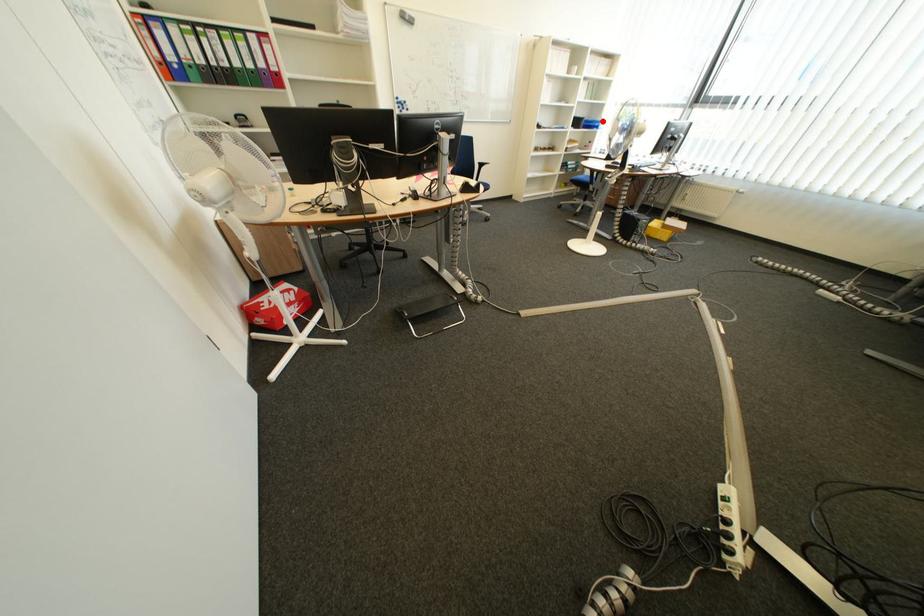
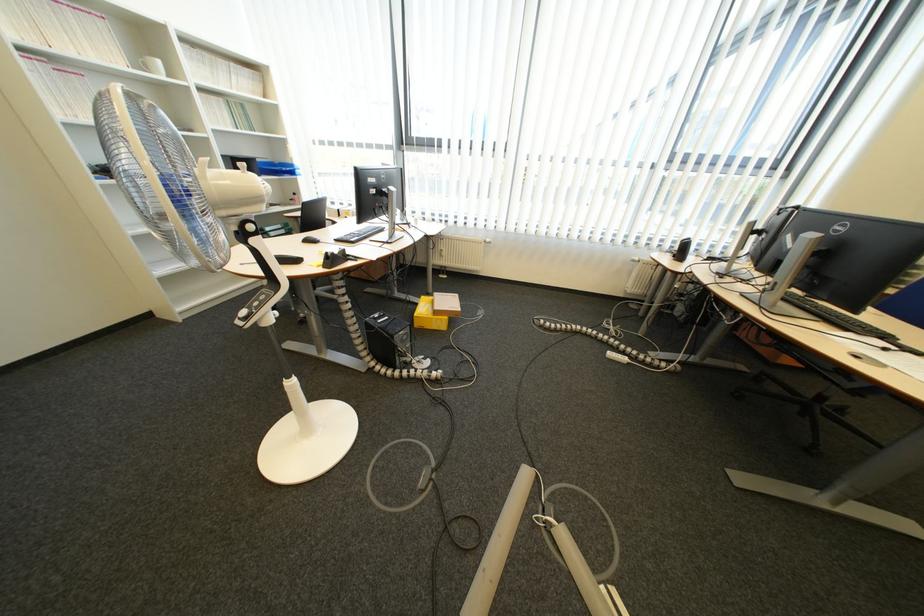
In the second image, find the point that corresponds to the highlighted location in the first image.

(289, 163)